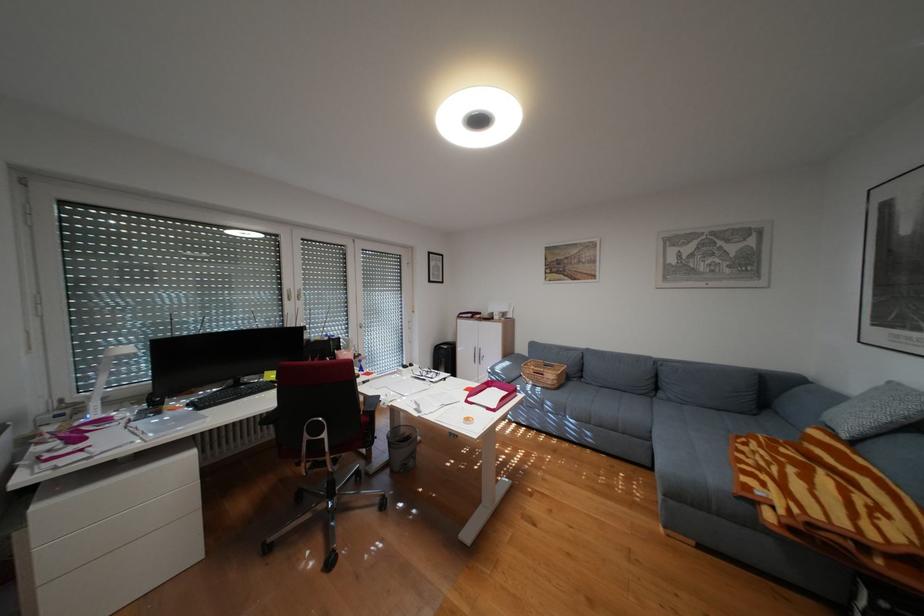
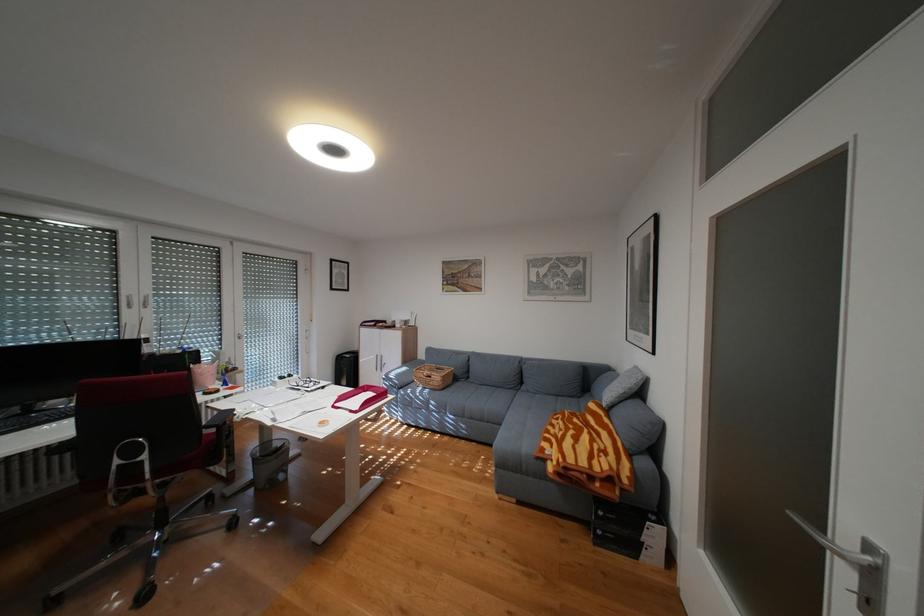
In the second image, find the point that corresponds to point (479, 400) in the first image.

(346, 406)